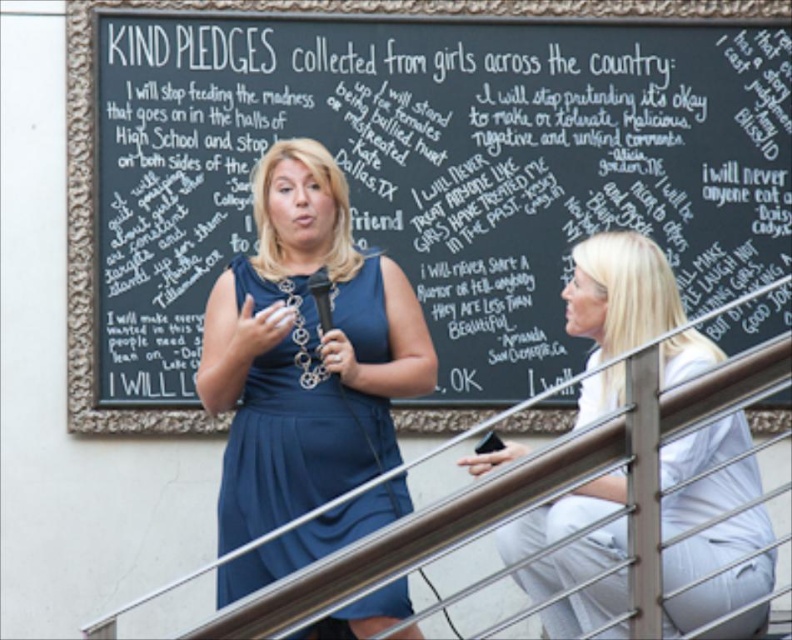
You are a photographer setting up for a speech event. You need to position a camera so that both the matte blue dress at center and the black chalkboard at upper center are clearly visible in the frame. Based on their positions, which object should be closer to the camera?

The matte blue dress at center is in front of the black chalkboard at upper center, so the matte blue dress at center should be closer to the camera to ensure both are visible.

In the scene shown: Based on the scene description, where is the black chalkboard at upper center located in terms of its 2D coordinates?

The black chalkboard at upper center is located at the 2D coordinates point (261, 12).